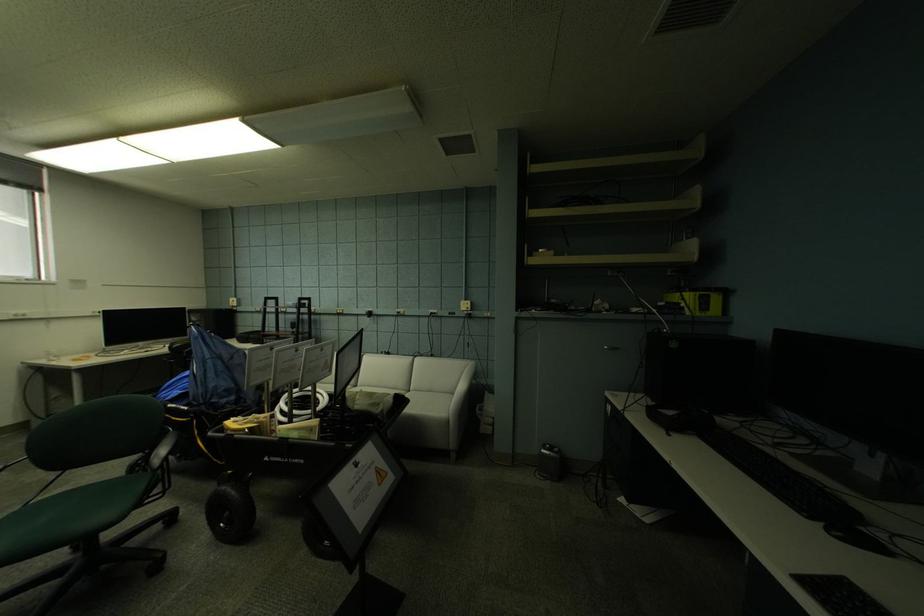
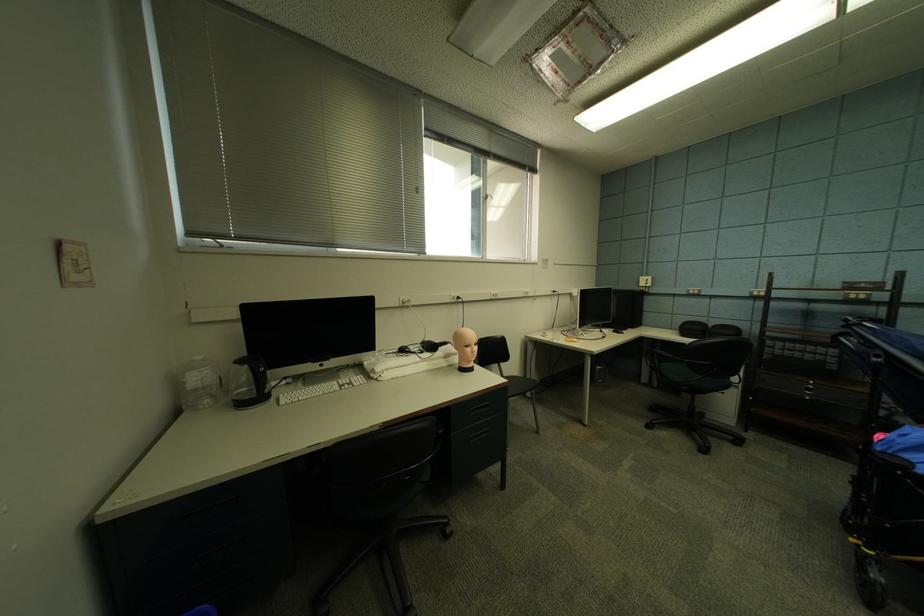
The point at (239, 302) is marked in the first image. Where is the corresponding point in the second image?

(650, 282)